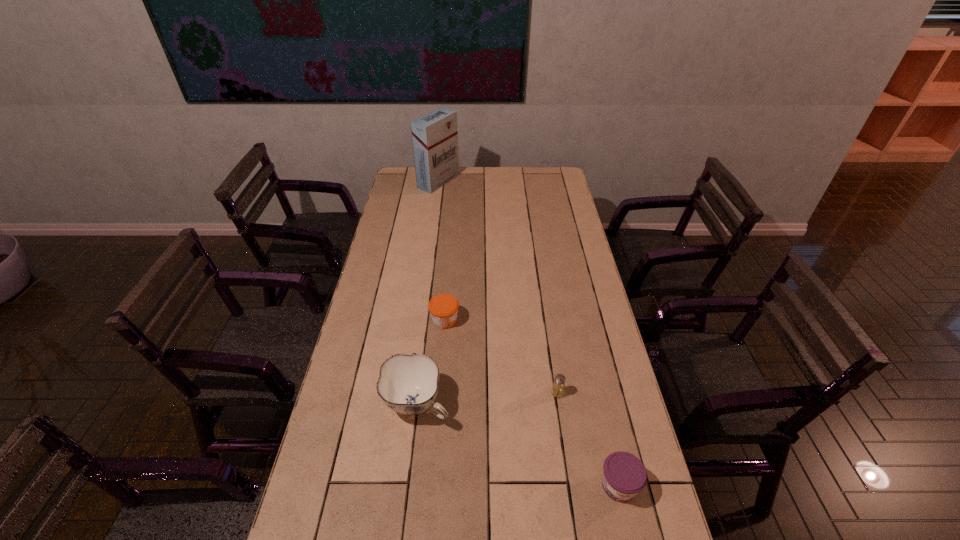
Identify the location of the tallest object. The image size is (960, 540). (435, 135).

Identify the location of cigarette case. The height and width of the screenshot is (540, 960). (435, 135).

Identify the location of chinaware. (408, 384).

The width and height of the screenshot is (960, 540). Identify the location of the fourth nearest object. (443, 308).

Identify the location of the left jam. The width and height of the screenshot is (960, 540). (443, 308).

Identify the location of the nearest object. (624, 475).

Where is `the rightmost object`? Image resolution: width=960 pixels, height=540 pixels. the rightmost object is located at coordinates (624, 475).

The height and width of the screenshot is (540, 960). I want to click on saltshaker, so click(x=558, y=388).

This screenshot has height=540, width=960. Identify the location of vacant space positioned 0.400m on the front of the farthest object. (430, 242).

The height and width of the screenshot is (540, 960). What are the coordinates of `vacant region located on the right of the chinaware` in the screenshot? It's located at (583, 404).